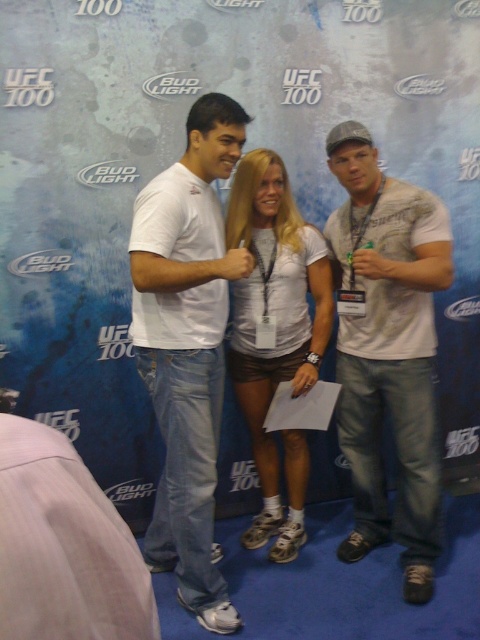
Who is more forward, (x=361, y=257) or (x=276, y=333)?

Point (x=361, y=257) is more forward.

Does point (408, 352) come behind point (298, 339)?

No, it is not.

At what (x,y) coordinates should I click in order to perform the action: click on white textured t-shirt at center. Please return your answer as a coordinate pair (x, y). Looking at the image, I should click on (387, 349).

Can you confirm if white cotton t-shirt at center is positioned above white matte shorts at center?

Correct, white cotton t-shirt at center is located above white matte shorts at center.

Who is more forward, (219, 220) or (252, 164)?

Point (219, 220) is more forward.

The image size is (480, 640). Find the location of `white cotton t-shirt at center`. white cotton t-shirt at center is located at coordinates [188, 348].

Locate an element on the screen. This screenshot has height=640, width=480. white textured t-shirt at center is located at coordinates (387, 349).

Is white textured t-shirt at center bigger than white cotton t-shirt at center?

No.

What are the coordinates of `white textured t-shirt at center` in the screenshot? It's located at (387, 349).